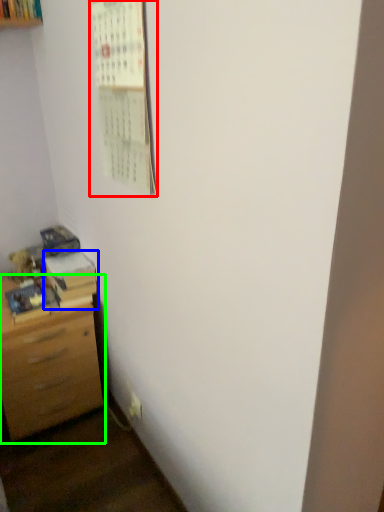
Question: Which is nearer to the bulletin board (highlighted by a red box)? book (highlighted by a blue box) or chest of drawers (highlighted by a green box).

Choices:
 (A) book
 (B) chest of drawers

Answer: (A)